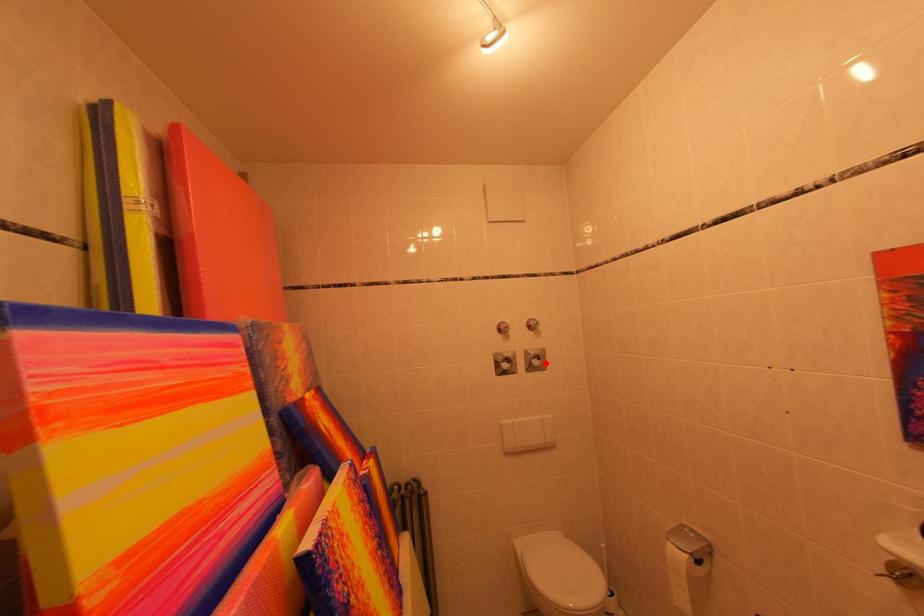
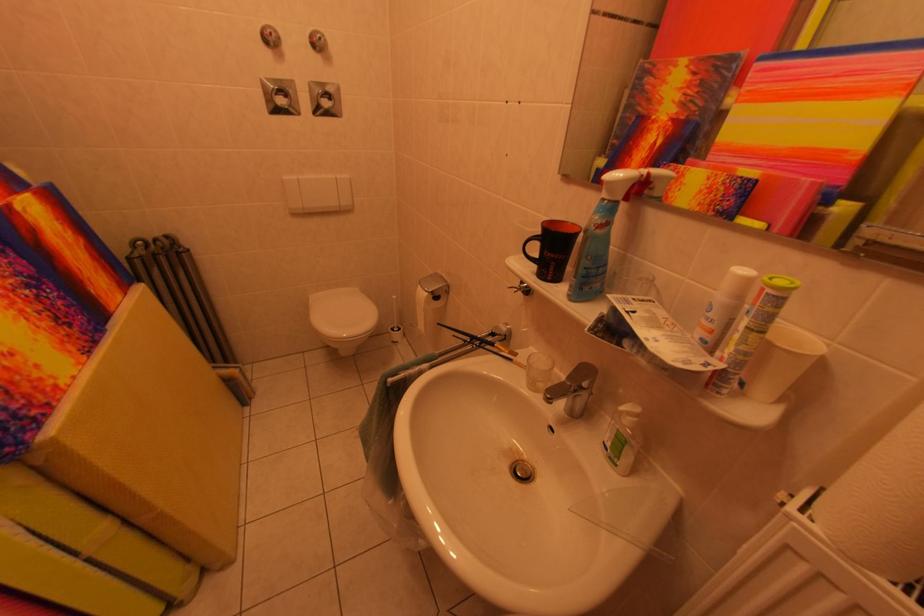
Locate, in the second image, the point that corresponds to the highlighted location in the first image.

(334, 103)